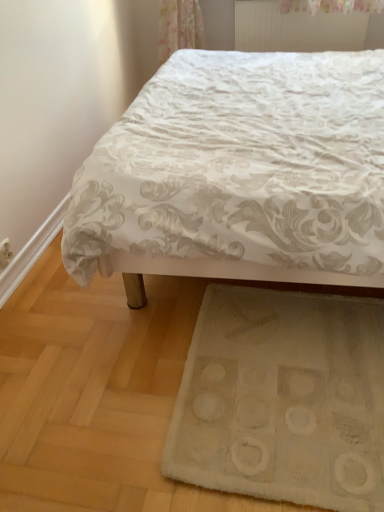
Question: In terms of size, does white textured bed at center appear bigger or smaller than white soft rug at lower center?

Choices:
 (A) small
 (B) big

Answer: (B)

Question: Choose the correct answer: Is white textured bed at center inside white soft rug at lower center or outside it?

Choices:
 (A) inside
 (B) outside

Answer: (B)

Question: Based on their relative distances, which object is nearer to the white textured bed at center?

Choices:
 (A) white soft rug at lower center
 (B) white textured radiator at upper center

Answer: (A)

Question: Estimate the real-world distances between objects in this image. Which object is closer to the white textured radiator at upper center?

Choices:
 (A) white textured bed at center
 (B) white soft rug at lower center

Answer: (A)